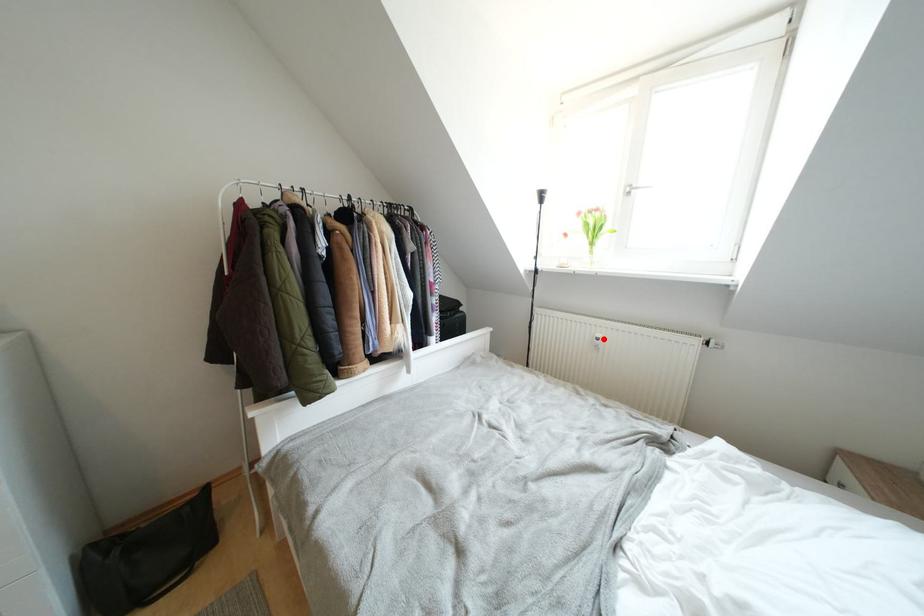
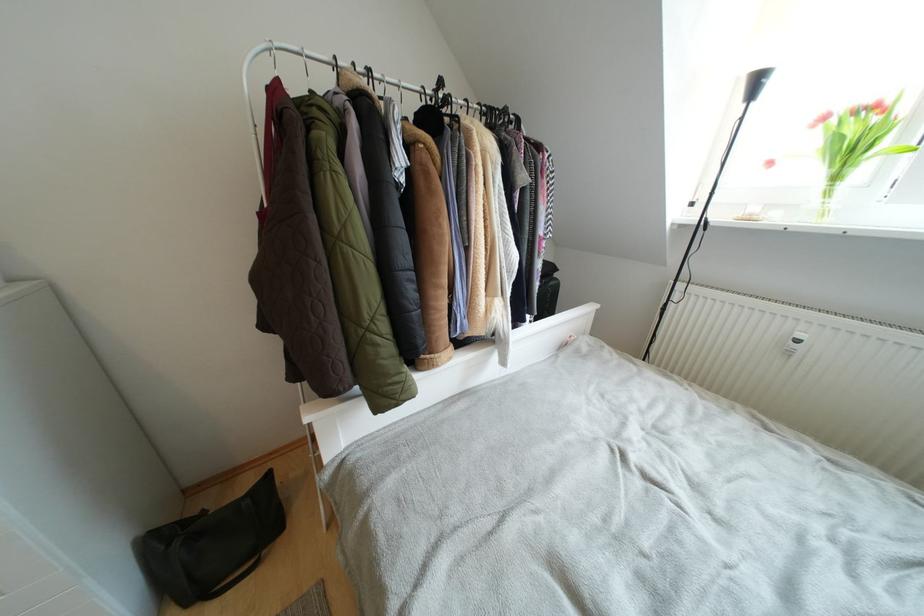
Where in the second image is the point corresponding to the highlighted location from the first image?

(805, 339)